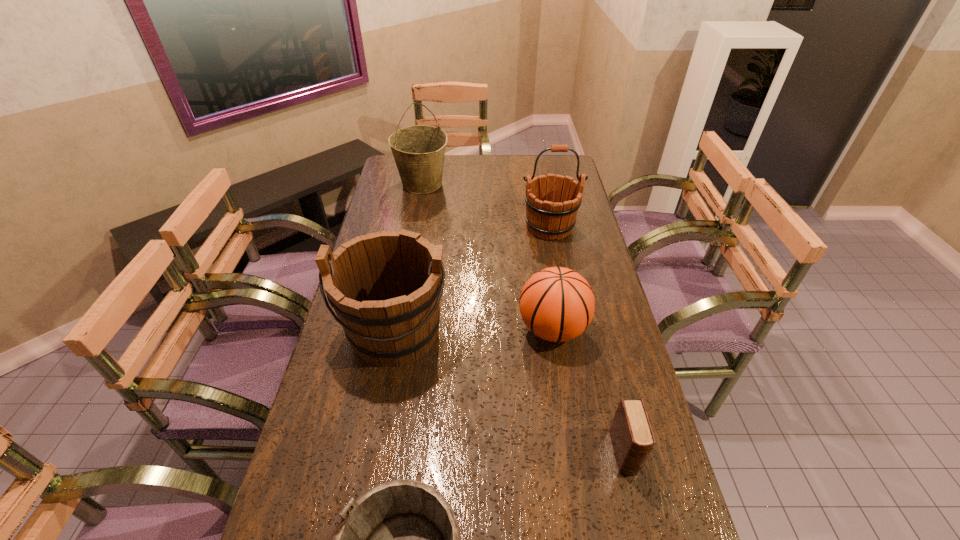
Locate an element on the screen. The height and width of the screenshot is (540, 960). the farthest object is located at coordinates (419, 150).

Where is `the second farthest wine bucket`? Image resolution: width=960 pixels, height=540 pixels. the second farthest wine bucket is located at coordinates (546, 216).

Image resolution: width=960 pixels, height=540 pixels. Identify the location of the second farthest object. (546, 216).

At what (x,y) coordinates should I click in order to perform the action: click on the second nearest wine bucket. Please return your answer as a coordinate pair (x, y). Looking at the image, I should click on (385, 287).

The image size is (960, 540). I want to click on the third shortest object, so click(x=557, y=304).

Where is `the second nearest object`? Image resolution: width=960 pixels, height=540 pixels. the second nearest object is located at coordinates (632, 437).

Locate an element on the screen. Image resolution: width=960 pixels, height=540 pixels. vacant space located 0.400m on the right of the farthest object is located at coordinates click(x=544, y=184).

Identify the location of free region located 0.180m on the left of the third nearest wine bucket. (471, 227).

Find the location of a particular element. This screenshot has width=960, height=540. blank area located 0.380m on the side of the second nearest wine bucket with the handle for carrying is located at coordinates (360, 532).

You are a GUI agent. You are given a task and a screenshot of the screen. Output one action in this format:
    pyautogui.click(x=<x>, y=<y>)
    Task: Click on the vacant space located 0.150m on the front of the third shortest object
    The height and width of the screenshot is (540, 960).
    Given the screenshot: What is the action you would take?
    pyautogui.click(x=564, y=407)